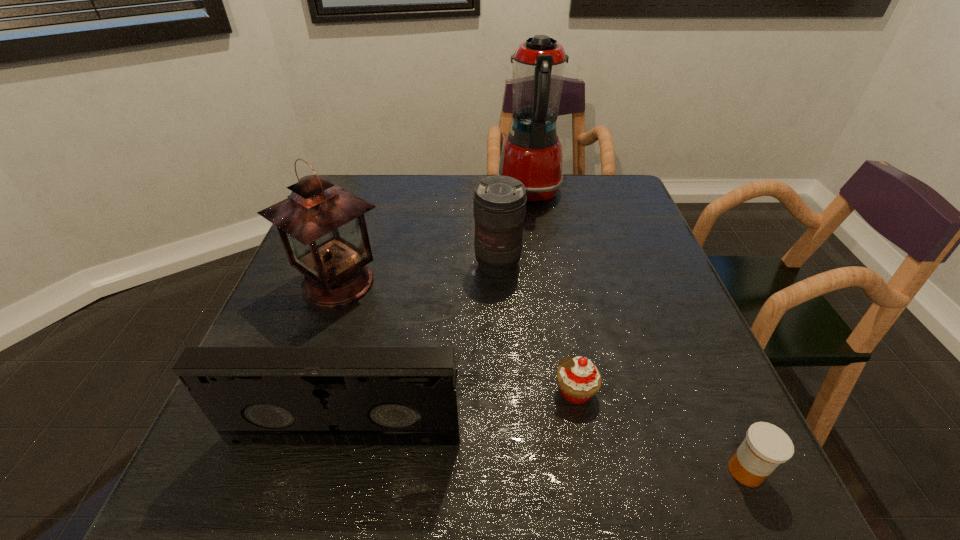
At what (x,y) coordinates should I click in order to perform the action: click on the farthest object. Please return your answer as a coordinate pair (x, y). The image size is (960, 540). Looking at the image, I should click on (532, 152).

Image resolution: width=960 pixels, height=540 pixels. Find the location of `food processor`. food processor is located at coordinates (532, 152).

Image resolution: width=960 pixels, height=540 pixels. Find the location of `the second tallest object`. the second tallest object is located at coordinates (322, 226).

I want to click on telephoto lens, so click(499, 203).

Identify the location of videotape. The image size is (960, 540). (251, 395).

Find the location of `the fourth farthest object`. the fourth farthest object is located at coordinates (579, 379).

The height and width of the screenshot is (540, 960). What are the coordinates of `medicine` in the screenshot? It's located at (766, 446).

You are a GUI agent. You are given a task and a screenshot of the screen. Output one action in this format:
    pyautogui.click(x=<x>, y=<y>)
    Task: Click on the rightmost object
    The image size is (960, 540).
    Given the screenshot: What is the action you would take?
    pyautogui.click(x=766, y=446)

Find the location of a particular element. This screenshot has width=960, height=540. free space located on the controls of the food processor is located at coordinates [474, 193].

Locate an element on the screen. This screenshot has width=960, height=540. free space located on the controls of the food processor is located at coordinates (442, 193).